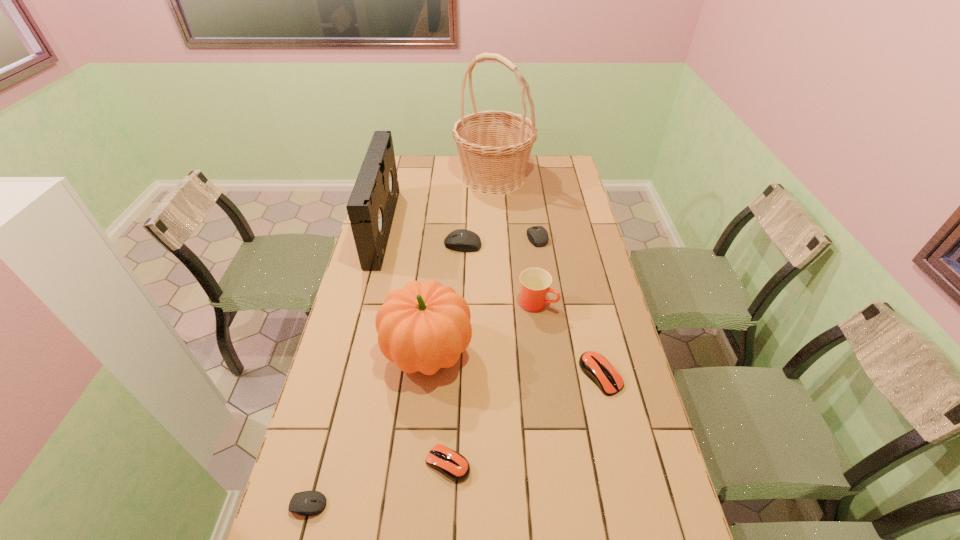
Locate an element on the screen. This screenshot has height=540, width=960. object that can be found as the eighth closest to the gray videotape is located at coordinates (306, 503).

Select which object is the seventh closest to the second black computer equipment from left to right. Please provide its 2D coordinates. Your answer should be formatted as a tuple, i.e. [(x, y)], where the tuple contains the x and y coordinates of a point satisfying the conditions above.

[(453, 465)]

Choose which computer equipment is the third nearest neighbor to the nearest object. Please provide its 2D coordinates. Your answer should be formatted as a tuple, i.e. [(x, y)], where the tuple contains the x and y coordinates of a point satisfying the conditions above.

[(462, 240)]

Locate an element on the screen. computer equipment object that ranks as the third closest to the nearest computer equipment is located at coordinates (462, 240).

Find the location of a particular element. The width and height of the screenshot is (960, 540). black computer equipment identified as the second closest to the fifth shortest object is located at coordinates (306, 503).

Where is `black computer equipment that stands as the third closest to the bigger orange computer mouse`? This screenshot has height=540, width=960. black computer equipment that stands as the third closest to the bigger orange computer mouse is located at coordinates (306, 503).

Locate an element on the screen. vacant space that satisfies the following two spatial constraints: 1. on the front side of the farther orange computer mouse; 2. on the right side of the tallest computer equipment is located at coordinates (457, 375).

Find the location of a particular element. The height and width of the screenshot is (540, 960). free space in the image that satisfies the following two spatial constraints: 1. on the side of the videotape with visible spindles; 2. on the left side of the fourth farthest computer equipment is located at coordinates (322, 463).